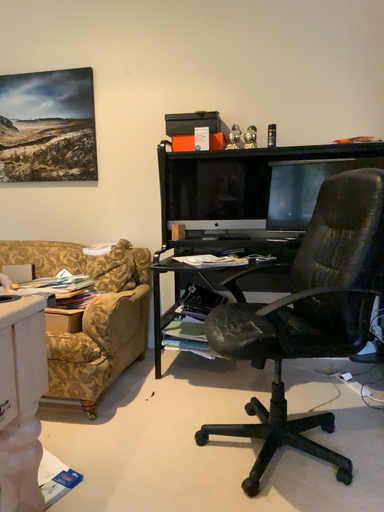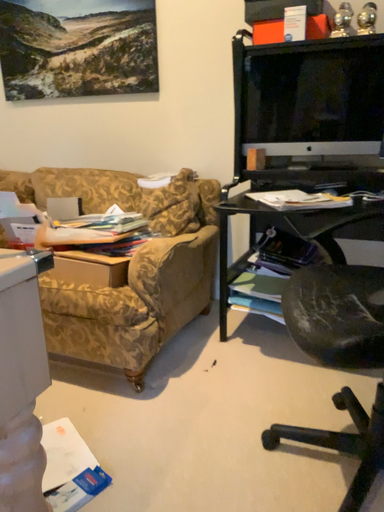
Question: Which way did the camera rotate in the video?

Choices:
 (A) rotated left
 (B) rotated right

Answer: (A)